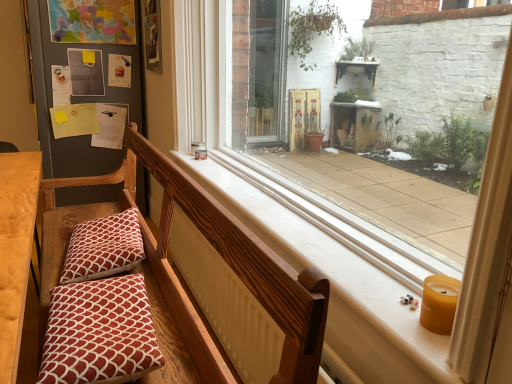
Identify the location of yellow wax candle at lower right. The image size is (512, 384). (439, 303).

Where is `wooden church bench at center`? The image size is (512, 384). wooden church bench at center is located at coordinates (159, 288).

Image resolution: width=512 pixels, height=384 pixels. What do you see at coordinates (159, 288) in the screenshot? I see `wooden church bench at center` at bounding box center [159, 288].

This screenshot has width=512, height=384. Describe the element at coordinates (383, 267) in the screenshot. I see `smooth white window sill at center` at that location.

The width and height of the screenshot is (512, 384). What are the coordinates of `yellow wax candle at lower right` in the screenshot? It's located at (439, 303).

In the scene shown: Which of these two, wooden bench cushion at left or red printed cushion at lower left, which appears as the second pillow when viewed from the back, is wider?

Wider between the two is red printed cushion at lower left, which appears as the second pillow when viewed from the back.

Which object is positioned more to the left, wooden bench cushion at left or red printed cushion at lower left, which appears as the second pillow when viewed from the back?

From the viewer's perspective, wooden bench cushion at left appears more on the left side.

In the image, there is a red printed cushion at lower left, the first pillow when ordered from front to back. Where is `furniture below it (from the image's perspective)`? The height and width of the screenshot is (384, 512). furniture below it (from the image's perspective) is located at coordinates (16, 250).

From the image's perspective, is smooth white window sill at center under red printed cushion at lower left, the first pillow when ordered from front to back?

Actually, smooth white window sill at center appears above red printed cushion at lower left, the first pillow when ordered from front to back, in the image.

Would you say smooth white window sill at center is inside or outside red printed cushion at lower left, the first pillow when ordered from front to back?

smooth white window sill at center cannot be found inside red printed cushion at lower left, the first pillow when ordered from front to back.

Looking at this image, considering the sizes of objects smooth white window sill at center and red printed cushion at lower left, the first pillow when ordered from front to back, in the image provided, who is bigger, smooth white window sill at center or red printed cushion at lower left, the first pillow when ordered from front to back,?

With larger size is smooth white window sill at center.

From a real-world perspective, relative to red printed cushion at lower left, the first pillow when ordered from front to back, is smooth white window sill at center vertically above or below?

In terms of real-world spatial position, smooth white window sill at center is above red printed cushion at lower left, the first pillow when ordered from front to back.

Is red printed cushion at lower left, the first pillow when ordered from front to back, facing away from wooden church bench at center?

Yes, wooden church bench at center is at the back of red printed cushion at lower left, the first pillow when ordered from front to back.

Is red printed cushion at lower left, which appears as the second pillow when viewed from the back, taller or shorter than wooden church bench at center?

Clearly, red printed cushion at lower left, which appears as the second pillow when viewed from the back, is shorter compared to wooden church bench at center.

Can you confirm if red printed cushion at lower left, the first pillow when ordered from front to back, is positioned to the right of wooden church bench at center?

Yes.

Is red printed cushion at lower left, the first pillow when ordered from front to back, behind wooden church bench at center?

Yes, red printed cushion at lower left, the first pillow when ordered from front to back, is further from the viewer.

You are a GUI agent. You are given a task and a screenshot of the screen. Output one action in this format:
    pyautogui.click(x=<x>, y=<y>)
    Task: Click on the church bench that is in front of the wooden bench cushion at left
    The width and height of the screenshot is (512, 384).
    Given the screenshot: What is the action you would take?
    pyautogui.click(x=159, y=288)

Which of these two, wooden church bench at center or wooden bench cushion at left, is bigger?

wooden church bench at center is bigger.

Considering the sizes of wooden church bench at center and wooden bench cushion at left in the image, is wooden church bench at center taller or shorter than wooden bench cushion at left?

Considering their sizes, wooden church bench at center has more height than wooden bench cushion at left.

Could you tell me if wooden church bench at center is turned towards wooden bench cushion at left?

Yes, wooden church bench at center is oriented towards wooden bench cushion at left.

Is smooth white window sill at center closer to the viewer compared to yellow wax candle at lower right?

Yes.

Is smooth white window sill at center bigger than yellow wax candle at lower right?

Yes, smooth white window sill at center is bigger than yellow wax candle at lower right.

From a real-world perspective, does smooth white window sill at center stand above yellow wax candle at lower right?

Yes, from a real-world perspective, smooth white window sill at center is over yellow wax candle at lower right

From the picture: What's the angular difference between smooth white window sill at center and yellow wax candle at lower right's facing directions?

There is a 3.6-degree angle between the facing directions of smooth white window sill at center and yellow wax candle at lower right.

Which of these two, patterned fabric pillow at lower left, which ranks as the second pillow in front-to-back order, or wooden bench cushion at left, stands shorter?

patterned fabric pillow at lower left, which ranks as the second pillow in front-to-back order.

In the scene shown: How much distance is there between patterned fabric pillow at lower left, which ranks as the second pillow in front-to-back order, and wooden bench cushion at left?

12.42 inches.

Relative to wooden bench cushion at left, is patterned fabric pillow at lower left, which ranks as the second pillow in front-to-back order, in front or behind?

In the image, patterned fabric pillow at lower left, which ranks as the second pillow in front-to-back order, appears behind wooden bench cushion at left.

Is patterned fabric pillow at lower left, placed as the 1th pillow when sorted from back to front, touching wooden bench cushion at left?

No.

Is point (67, 272) more distant than point (429, 280)?

Yes, point (67, 272) is farther from viewer.

Considering the relative sizes of patterned fabric pillow at lower left, which ranks as the second pillow in front-to-back order, and yellow wax candle at lower right in the image provided, is patterned fabric pillow at lower left, which ranks as the second pillow in front-to-back order, bigger than yellow wax candle at lower right?

Yes.

From a real-world perspective, is patterned fabric pillow at lower left, which ranks as the second pillow in front-to-back order, under yellow wax candle at lower right?

Indeed, from a real-world perspective, patterned fabric pillow at lower left, which ranks as the second pillow in front-to-back order, is positioned beneath yellow wax candle at lower right.

Relative to yellow wax candle at lower right, is patterned fabric pillow at lower left, placed as the 1th pillow when sorted from back to front, in front or behind?

patterned fabric pillow at lower left, placed as the 1th pillow when sorted from back to front, is positioned farther from the viewer than yellow wax candle at lower right.

This screenshot has height=384, width=512. Find the location of `pillow that is the 1st object above the wooden bench cushion at left (from a real-world perspective)`. pillow that is the 1st object above the wooden bench cushion at left (from a real-world perspective) is located at coordinates coord(99,331).

At what (x,y) coordinates should I click in order to perform the action: click on pillow that is the 2nd object located below the smooth white window sill at center (from the image's perspective). Please return your answer as a coordinate pair (x, y). The image size is (512, 384). Looking at the image, I should click on (99, 331).

Estimate the real-world distances between objects in this image. Which object is closer to wooden bench cushion at left, patterned fabric pillow at lower left, which ranks as the second pillow in front-to-back order, or red printed cushion at lower left, which appears as the second pillow when viewed from the back?

The object closer to wooden bench cushion at left is red printed cushion at lower left, which appears as the second pillow when viewed from the back.

Which object lies nearer to the anchor point smooth white window sill at center, wooden church bench at center or red printed cushion at lower left, which appears as the second pillow when viewed from the back?

Among the two, wooden church bench at center is located nearer to smooth white window sill at center.

Considering their positions, is patterned fabric pillow at lower left, placed as the 1th pillow when sorted from back to front, positioned closer to wooden church bench at center than smooth white window sill at center?

patterned fabric pillow at lower left, placed as the 1th pillow when sorted from back to front, is positioned closer to the anchor wooden church bench at center.

Estimate the real-world distances between objects in this image. Which object is further from wooden church bench at center, red printed cushion at lower left, the first pillow when ordered from front to back, or patterned fabric pillow at lower left, placed as the 1th pillow when sorted from back to front?

red printed cushion at lower left, the first pillow when ordered from front to back.

Estimate the real-world distances between objects in this image. Which object is closer to red printed cushion at lower left, the first pillow when ordered from front to back, patterned fabric pillow at lower left, placed as the 1th pillow when sorted from back to front, or wooden church bench at center?

Based on the image, wooden church bench at center appears to be nearer to red printed cushion at lower left, the first pillow when ordered from front to back.

Based on their spatial positions, is wooden church bench at center or smooth white window sill at center closer to yellow wax candle at lower right?

The object closer to yellow wax candle at lower right is smooth white window sill at center.

Based on their spatial positions, is wooden bench cushion at left or smooth white window sill at center further from yellow wax candle at lower right?

Among the two, wooden bench cushion at left is located further to yellow wax candle at lower right.

From the image, which object appears to be nearer to wooden church bench at center, red printed cushion at lower left, which appears as the second pillow when viewed from the back, or smooth white window sill at center?

red printed cushion at lower left, which appears as the second pillow when viewed from the back, lies closer to wooden church bench at center than the other object.

Locate an element on the screen. Image resolution: width=512 pixels, height=384 pixels. window between wooden church bench at center and yellow wax candle at lower right in the horizontal direction is located at coordinates (383, 267).

Where is `window situated between patterned fabric pillow at lower left, which ranks as the second pillow in front-to-back order, and yellow wax candle at lower right from left to right`? window situated between patterned fabric pillow at lower left, which ranks as the second pillow in front-to-back order, and yellow wax candle at lower right from left to right is located at coordinates coord(383,267).

What are the coordinates of `pillow between patterned fabric pillow at lower left, which ranks as the second pillow in front-to-back order, and yellow wax candle at lower right` in the screenshot? It's located at (99, 331).

Locate an element on the screen. The width and height of the screenshot is (512, 384). window between wooden bench cushion at left and yellow wax candle at lower right in the horizontal direction is located at coordinates (383, 267).